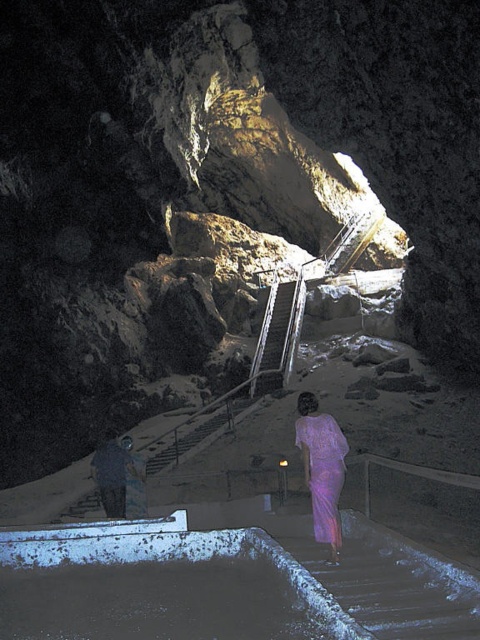
Can you confirm if purple silk dress at center is taller than dark gray stone statue at lower left?

Correct, purple silk dress at center is much taller as dark gray stone statue at lower left.

Is purple silk dress at center positioned at the back of dark gray stone statue at lower left?

No, it is not.

Is point (315, 458) closer to camera compared to point (116, 467)?

Yes, point (315, 458) is closer to viewer.

Identify the location of purple silk dress at center. (322, 468).